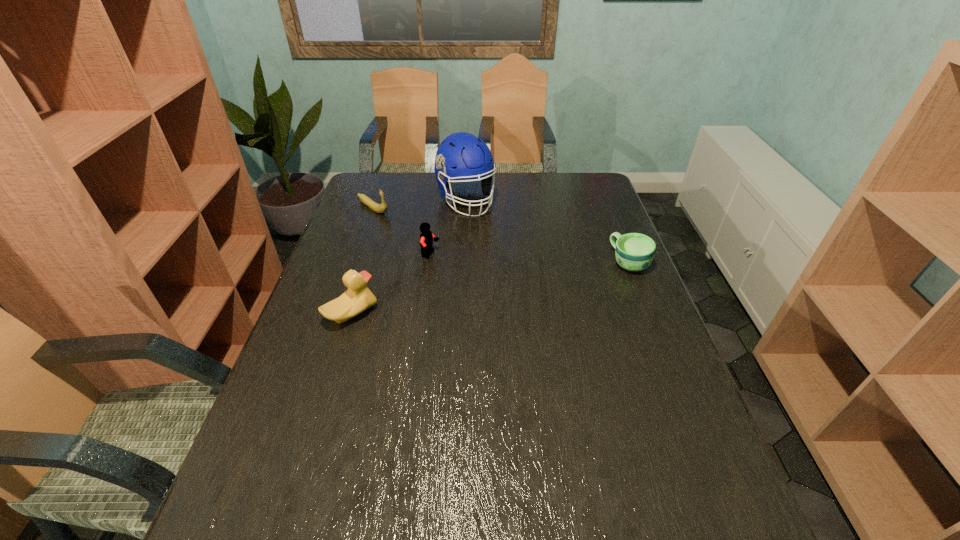
In order to click on vacant position in the image that satisfies the following two spatial constraints: 1. on the back side of the Lego; 2. on the right side of the tallest object in this screenshot , I will do `click(438, 200)`.

The height and width of the screenshot is (540, 960). Identify the location of vacant point that satisfies the following two spatial constraints: 1. on the front side of the banana; 2. at the beak of the duck. (337, 314).

The width and height of the screenshot is (960, 540). What are the coordinates of `free point that satisfies the following two spatial constraints: 1. on the front side of the banana; 2. on the right side of the Lego` in the screenshot? It's located at tap(357, 255).

The height and width of the screenshot is (540, 960). In order to click on vacant space that satisfies the following two spatial constraints: 1. on the front side of the banana; 2. on the left side of the shortest object in this screenshot , I will do `click(354, 263)`.